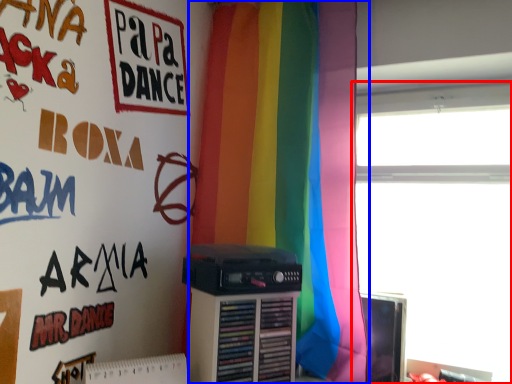
Question: Which point is further to the camera, window (highlighted by a red box) or curtain (highlighted by a blue box)?

Choices:
 (A) window
 (B) curtain

Answer: (A)